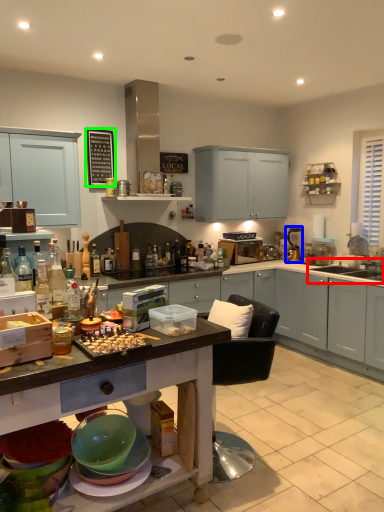
Question: Which object is positioned farthest from sink (highlighted by a red box)? Select from appliance (highlighted by a blue box) and bulletin board (highlighted by a green box).

Choices:
 (A) appliance
 (B) bulletin board

Answer: (B)